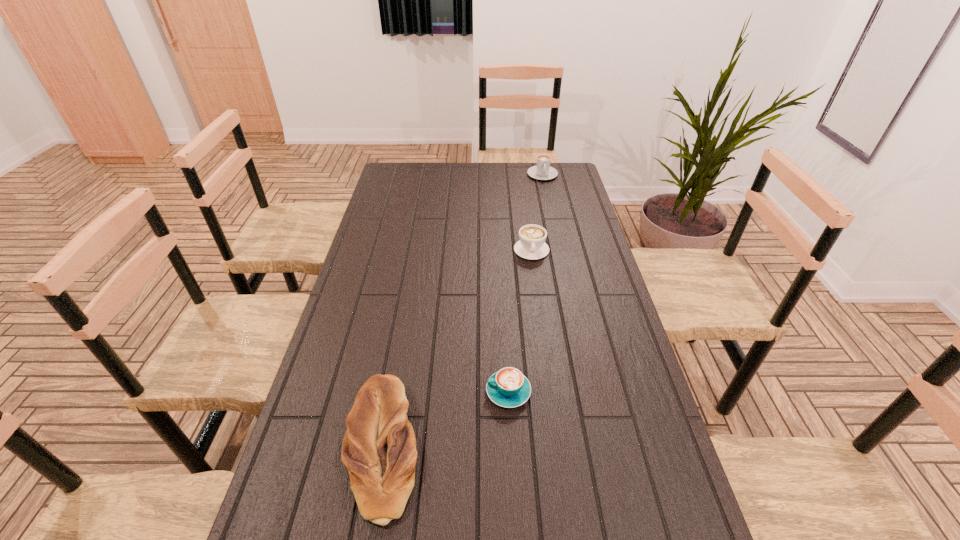
Image resolution: width=960 pixels, height=540 pixels. What are the coordinates of `free spot between the nearest cappuccino and the second farthest object` in the screenshot? It's located at (520, 321).

The width and height of the screenshot is (960, 540). I want to click on vacant point located between the third nearest object and the bread, so click(457, 348).

What are the coordinates of `free spot between the third nearest object and the leftmost object` in the screenshot? It's located at (457, 348).

Locate an element on the screen. This screenshot has height=540, width=960. empty space between the third nearest object and the farthest object is located at coordinates (537, 213).

Locate an element on the screen. free space between the shortest object and the second farthest cappuccino is located at coordinates (520, 321).

Locate an element on the screen. This screenshot has height=540, width=960. free space between the leftmost object and the second farthest cappuccino is located at coordinates (457, 348).

The width and height of the screenshot is (960, 540). I want to click on vacant space in between the farthest cappuccino and the bread, so click(x=463, y=310).

Where is `free space between the farthest object and the shortest object`? This screenshot has width=960, height=540. free space between the farthest object and the shortest object is located at coordinates pyautogui.click(x=525, y=283).

Image resolution: width=960 pixels, height=540 pixels. What are the coordinates of `free point between the nearest cappuccino and the farthest cappuccino` in the screenshot? It's located at (525, 283).

The width and height of the screenshot is (960, 540). Find the location of `vacant area that lies between the leftmost object and the farthest cappuccino`. vacant area that lies between the leftmost object and the farthest cappuccino is located at coordinates (463, 310).